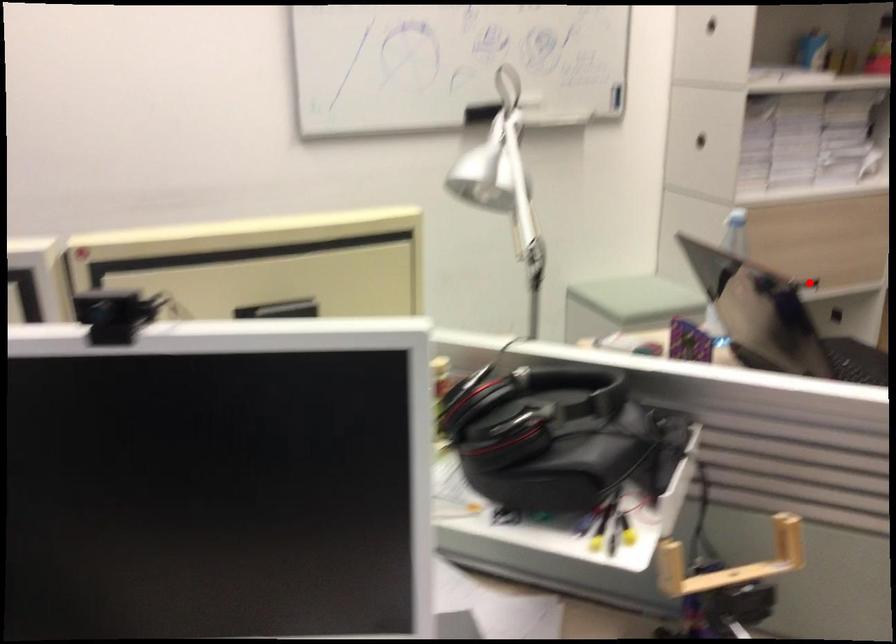
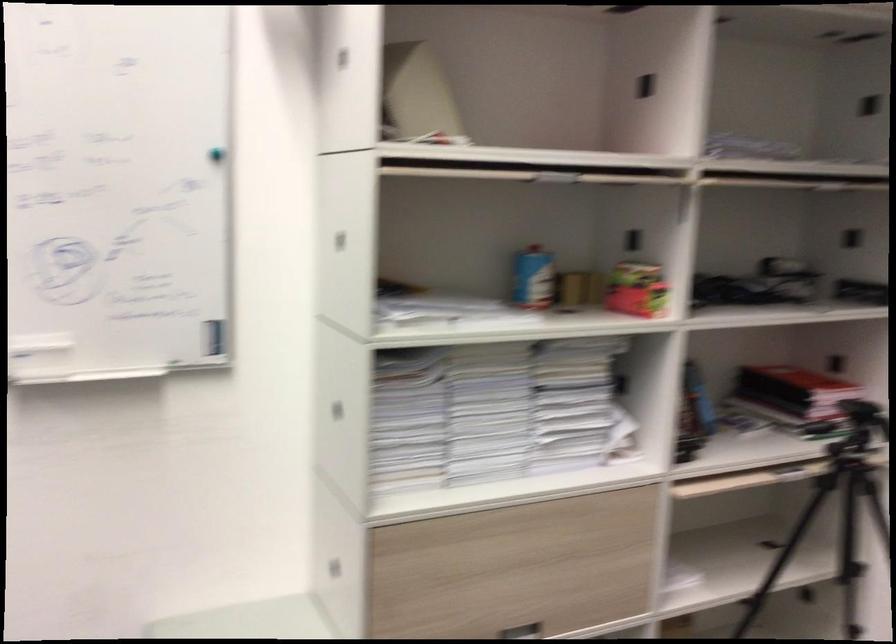
Question: I am providing you with two images of the same scene from different viewpoints. Given a red point in image1, look at the same physical point in image2. Is it:

Choices:
 (A) Closer to the viewpoint
 (B) Farther from the viewpoint

Answer: (A)